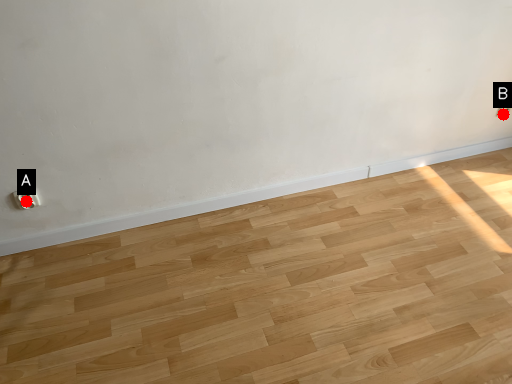
Question: Two points are circled on the image, labeled by A and B beside each circle. Which point appears closest to the camera in this image?

Choices:
 (A) A is closer
 (B) B is closer

Answer: (A)